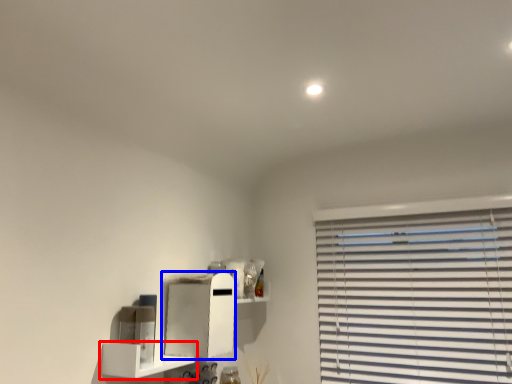
Question: Among these objects, which one is farthest to the camera, shelf (highlighted by a red box) or cabinet (highlighted by a blue box)?

Choices:
 (A) shelf
 (B) cabinet

Answer: (B)